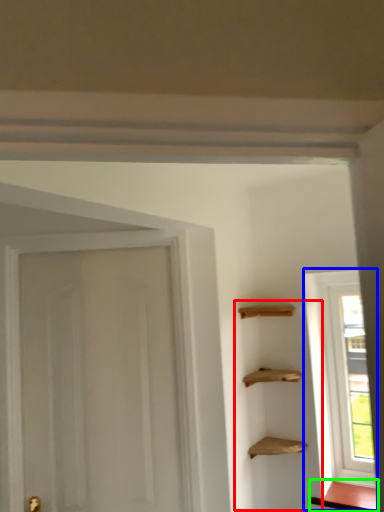
Question: Based on their relative distances, which object is nearer to cabinetry (highlighted by a red box)? Choose from window (highlighted by a blue box) and cabinetry (highlighted by a green box).

Choices:
 (A) window
 (B) cabinetry

Answer: (A)